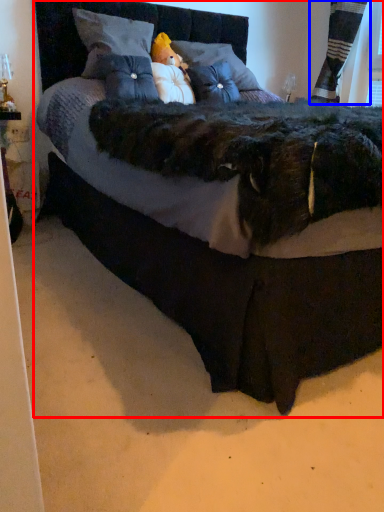
Question: Which object is closer to the camera taking this photo, bed (highlighted by a red box) or curtain (highlighted by a blue box)?

Choices:
 (A) bed
 (B) curtain

Answer: (A)